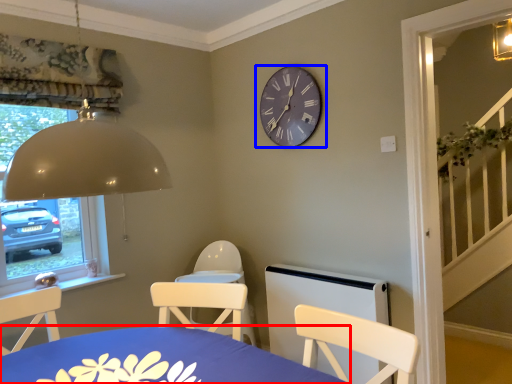
Question: Among these objects, which one is nearest to the camera, table (highlighted by a red box) or wall clock (highlighted by a blue box)?

Choices:
 (A) table
 (B) wall clock

Answer: (A)